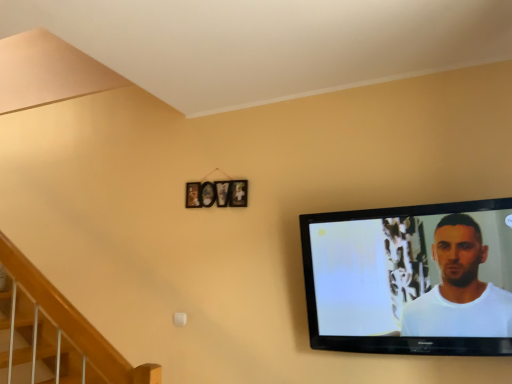
Where is `wooden picture frame at center`? The width and height of the screenshot is (512, 384). wooden picture frame at center is located at coordinates (218, 194).

The image size is (512, 384). What do you see at coordinates (218, 194) in the screenshot?
I see `wooden picture frame at center` at bounding box center [218, 194].

What is the approximate height of black glossy tv at right?

28.02 inches.

The image size is (512, 384). I want to click on black glossy tv at right, so click(411, 279).

Describe the element at coordinates (411, 279) in the screenshot. I see `black glossy tv at right` at that location.

At what (x,y) coordinates should I click in order to perform the action: click on wooden picture frame at center. Please return your answer as a coordinate pair (x, y). The width and height of the screenshot is (512, 384). Looking at the image, I should click on (218, 194).

Between wooden picture frame at center and black glossy tv at right, which one appears on the right side from the viewer's perspective?

black glossy tv at right.

Considering the positions of objects wooden picture frame at center and black glossy tv at right in the image provided, who is behind, wooden picture frame at center or black glossy tv at right?

wooden picture frame at center is further from the camera.

Which is behind, point (228, 195) or point (433, 222)?

Point (228, 195)

From the image's perspective, who appears lower, wooden picture frame at center or black glossy tv at right?

black glossy tv at right is shown below in the image.

From a real-world perspective, is wooden picture frame at center physically located above or below black glossy tv at right?

In terms of real-world spatial position, wooden picture frame at center is above black glossy tv at right.

Can you confirm if wooden picture frame at center is wider than black glossy tv at right?

No.

Considering the relative sizes of wooden picture frame at center and black glossy tv at right in the image provided, is wooden picture frame at center taller than black glossy tv at right?

No, wooden picture frame at center is not taller than black glossy tv at right.

Does wooden picture frame at center have a larger size compared to black glossy tv at right?

Incorrect, wooden picture frame at center is not larger than black glossy tv at right.

Is wooden picture frame at center completely or partially outside of black glossy tv at right?

Yes, wooden picture frame at center is located beyond the bounds of black glossy tv at right.

Is wooden picture frame at center far away from black glossy tv at right?

wooden picture frame at center is near black glossy tv at right, not far away.

Does wooden picture frame at center turn towards black glossy tv at right?

No, wooden picture frame at center is not facing towards black glossy tv at right.

In the scene shown: Can you tell me how much wooden picture frame at center and black glossy tv at right differ in facing direction?

1.12 degrees separate the facing orientations of wooden picture frame at center and black glossy tv at right.

Image resolution: width=512 pixels, height=384 pixels. I want to click on television in front of the wooden picture frame at center, so click(x=411, y=279).

Between black glossy tv at right and wooden picture frame at center, which one appears on the left side from the viewer's perspective?

From the viewer's perspective, wooden picture frame at center appears more on the left side.

Which object is closer to the camera taking this photo, black glossy tv at right or wooden picture frame at center?

black glossy tv at right is in front.

Is point (303, 224) in front of point (187, 200)?

Yes, point (303, 224) is closer to viewer.

From the picture: From the image's perspective, is black glossy tv at right positioned above or below wooden picture frame at center?

black glossy tv at right is situated lower than wooden picture frame at center in the image.

From a real-world perspective, is black glossy tv at right below wooden picture frame at center?

Yes, from a real-world perspective, black glossy tv at right is below wooden picture frame at center.

Between black glossy tv at right and wooden picture frame at center, which one has larger width?

With larger width is black glossy tv at right.

Is black glossy tv at right shorter than wooden picture frame at center?

Incorrect, the height of black glossy tv at right does not fall short of that of wooden picture frame at center.

Can you confirm if black glossy tv at right is smaller than wooden picture frame at center?

Incorrect, black glossy tv at right is not smaller in size than wooden picture frame at center.

Would you say black glossy tv at right is outside wooden picture frame at center?

Yes, black glossy tv at right is outside of wooden picture frame at center.

Is black glossy tv at right far away from wooden picture frame at center?

black glossy tv at right is near wooden picture frame at center, not far away.

Is black glossy tv at right oriented away from wooden picture frame at center?

black glossy tv at right is not turned away from wooden picture frame at center.

Where is `television directly beneath the wooden picture frame at center (from a real-world perspective)`? This screenshot has width=512, height=384. television directly beneath the wooden picture frame at center (from a real-world perspective) is located at coordinates (411, 279).

This screenshot has height=384, width=512. In order to click on television that appears below the wooden picture frame at center (from the image's perspective) in this screenshot , I will do `click(411, 279)`.

There is a black glossy tv at right. At what (x,y) coordinates should I click in order to perform the action: click on picture frame above it (from a real-world perspective). Please return your answer as a coordinate pair (x, y). The height and width of the screenshot is (384, 512). Looking at the image, I should click on (218, 194).